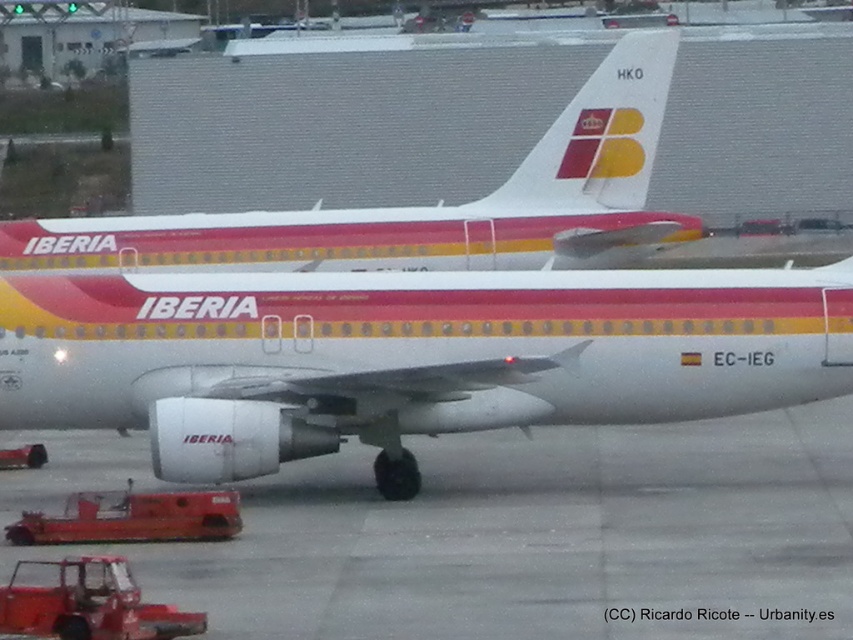
This screenshot has height=640, width=853. What are the coordinates of `white matte airplane at center` in the screenshot? It's located at (407, 356).

Is white matte airplane at center above white textured tail at center?

Incorrect, white matte airplane at center is not positioned above white textured tail at center.

Find the location of a particular element. white matte airplane at center is located at coordinates (407, 356).

The image size is (853, 640). In order to click on white smooth tarmac at center in this screenshot , I will do [543, 538].

Is white smooth tarmac at center positioned in front of white textured tail at center?

Yes.

This screenshot has height=640, width=853. What do you see at coordinates (543, 538) in the screenshot? I see `white smooth tarmac at center` at bounding box center [543, 538].

Where is `white smooth tarmac at center`? The width and height of the screenshot is (853, 640). white smooth tarmac at center is located at coordinates (543, 538).

Is white glossy airplane at center above white textured tail at center?

Incorrect, white glossy airplane at center is not positioned above white textured tail at center.

Image resolution: width=853 pixels, height=640 pixels. What are the coordinates of `white glossy airplane at center` in the screenshot? It's located at (430, 205).

Does point (506, 243) come behind point (643, 125)?

Yes.

Identify the location of white glossy airplane at center. (430, 205).